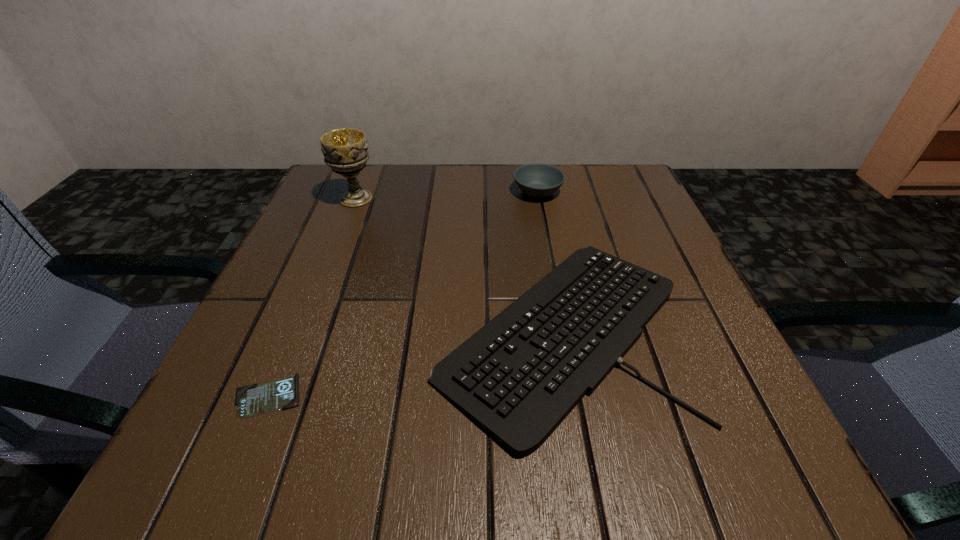
The image size is (960, 540). I want to click on computer keyboard present at the near edge, so click(518, 377).

Locate an element on the screen. identity card located at the near edge is located at coordinates (252, 400).

Find the location of a particular element. Image resolution: width=960 pixels, height=540 pixels. chalice situated at the left edge is located at coordinates (345, 150).

I want to click on identity card located at the left edge, so click(252, 400).

Find the location of a particular element. object present at the right edge is located at coordinates (518, 377).

I want to click on object that is at the far left corner, so click(345, 150).

Identify the location of object that is at the near left corner. The image size is (960, 540). (252, 400).

This screenshot has width=960, height=540. Identify the location of object that is at the near right corner. (518, 377).

Identify the location of free space at the far edge of the desktop. (537, 211).

Find the location of a particular element. The height and width of the screenshot is (540, 960). free region at the left edge is located at coordinates (300, 395).